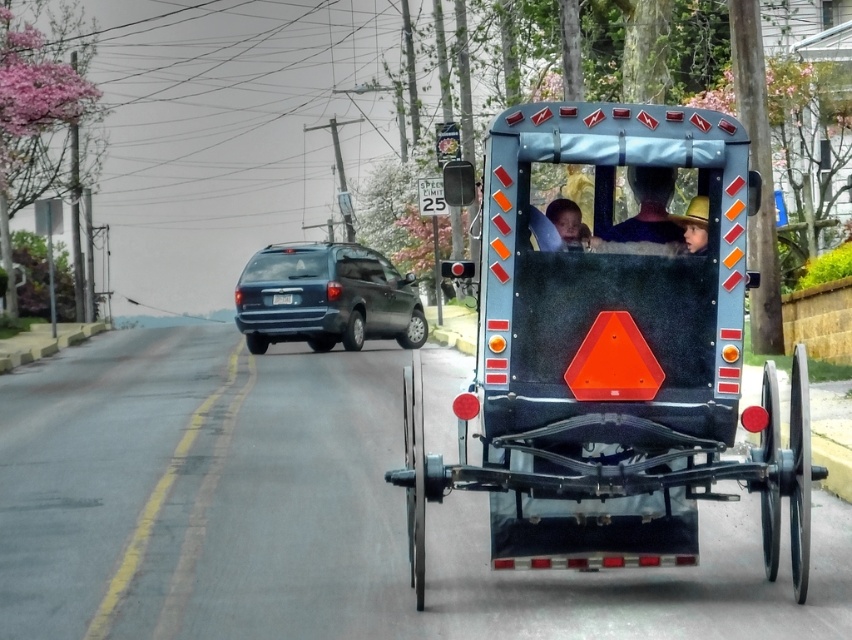
You are a pedestrian standing at the crosswalk and see both the glossy metallic suv at center and the matte black face at center. Which object is bigger?

The glossy metallic suv at center is larger than the matte black face at center.

In the scene shown: You are a pedestrian standing on the sidewalk. You see a glossy metallic suv at center and a blue fabric hat at center. Which object is closer to the ground?

The glossy metallic suv at center is located below blue fabric hat at center, so the suv is closer to the ground.

You are a pedestrian standing at the center of the image and see the blue fabric hat at center. If you want to pick it up, which direction should you move relative to your current position?

The blue fabric hat at center is located at point [648,209], so you should move towards the center of the image to pick it up since that is where the hat is positioned.